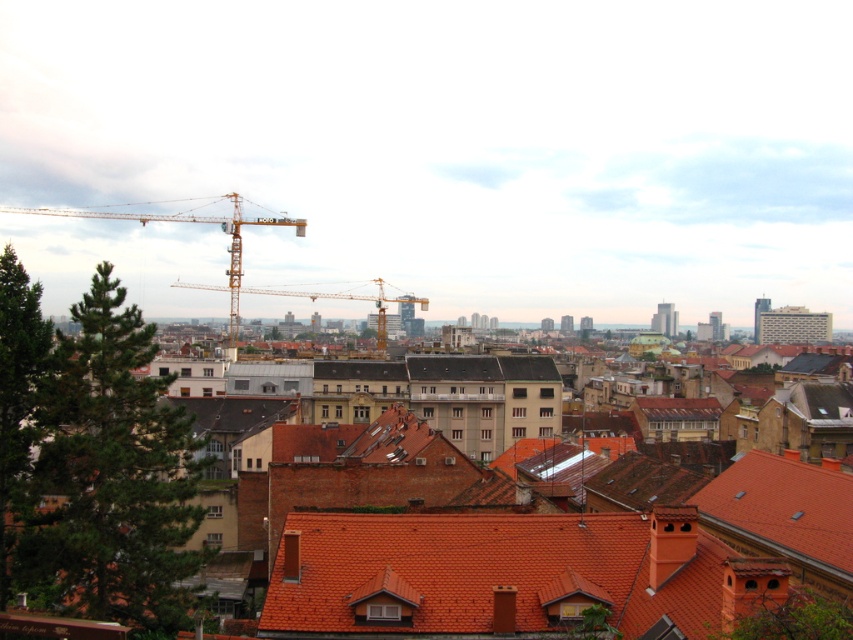
Question: Which point is farther to the camera?

Choices:
 (A) yellow metallic crane at upper center
 (B) terracotta tiled roof at center
 (C) metallic yellow crane at center
 (D) brown brick building at center

Answer: (C)

Question: Which of these objects is positioned farthest from the brown brick building at center?

Choices:
 (A) terracotta tiled roof at center
 (B) yellow metallic crane at upper center

Answer: (B)

Question: Does terracotta tiled roof at center appear under metallic yellow crane at center?

Choices:
 (A) yes
 (B) no

Answer: (A)

Question: Is brown brick building at center wider than yellow metallic crane at upper center?

Choices:
 (A) yes
 (B) no

Answer: (B)

Question: Among these points, which one is farthest from the camera?

Choices:
 (A) (325, 545)
 (B) (492, 608)

Answer: (A)

Question: In this image, where is terracotta tiled roof at center located relative to yellow metallic crane at upper center?

Choices:
 (A) above
 (B) below

Answer: (B)